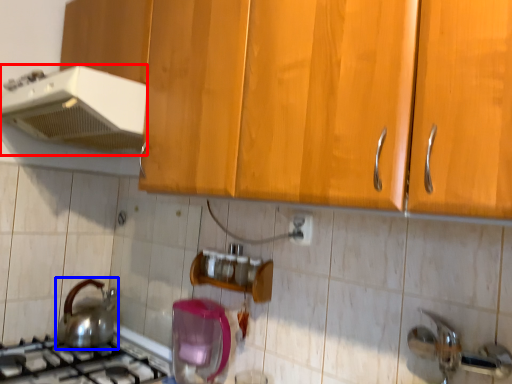
Question: Which of the following is the farthest to the observer, kitchen appliance (highlighted by a red box) or kitchen appliance (highlighted by a blue box)?

Choices:
 (A) kitchen appliance
 (B) kitchen appliance

Answer: (B)